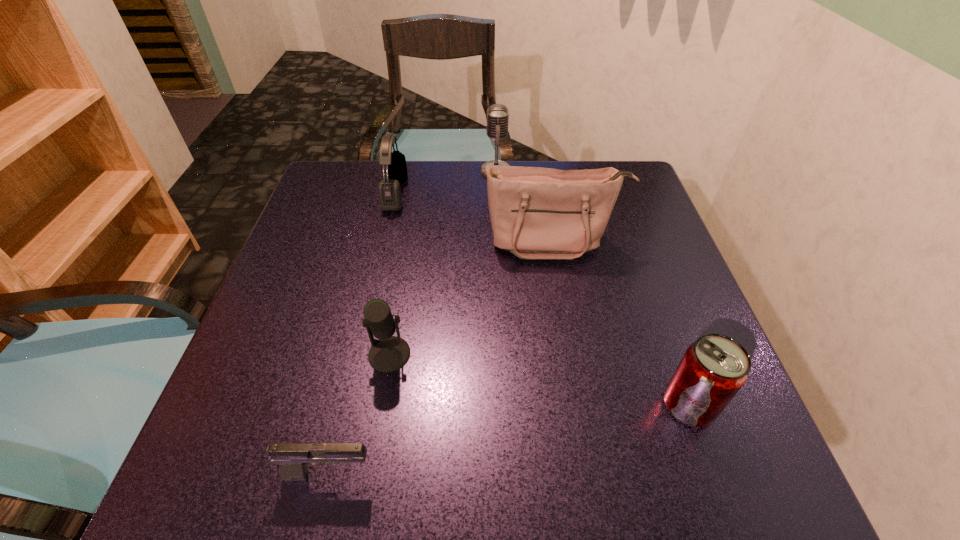
At what (x,y) coordinates should I click in order to perform the action: click on pop soda present at the right edge. Please return your answer as a coordinate pair (x, y). Looking at the image, I should click on (714, 368).

You are a GUI agent. You are given a task and a screenshot of the screen. Output one action in this format:
    pyautogui.click(x=<x>, y=<y>)
    Task: Click on the object present at the near left corner
    The height and width of the screenshot is (540, 960).
    Given the screenshot: What is the action you would take?
    pyautogui.click(x=293, y=458)

The height and width of the screenshot is (540, 960). I want to click on free space at the far edge of the desktop, so click(x=437, y=169).

At what (x,y) coordinates should I click in order to perform the action: click on blank space at the left edge of the desktop. Please return your answer as a coordinate pair (x, y). The width and height of the screenshot is (960, 540). Looking at the image, I should click on 269,326.

This screenshot has height=540, width=960. I want to click on free point at the right edge, so click(661, 274).

In the image, there is a desktop. At what (x,y) coordinates should I click in order to perform the action: click on blank space at the far left corner. Please return your answer as a coordinate pair (x, y). The image size is (960, 540). Looking at the image, I should click on (369, 204).

This screenshot has height=540, width=960. What are the coordinates of `vacant space at the near left corner of the desktop` in the screenshot? It's located at (201, 470).

This screenshot has height=540, width=960. In order to click on free space at the far right corner of the desktop in this screenshot , I will do `click(591, 163)`.

Locate an element on the screen. The height and width of the screenshot is (540, 960). free spot between the nearest object and the right microphone is located at coordinates (413, 322).

Where is `unoccupied area between the nearer microphone and the fifth farthest object`? This screenshot has height=540, width=960. unoccupied area between the nearer microphone and the fifth farthest object is located at coordinates (540, 380).